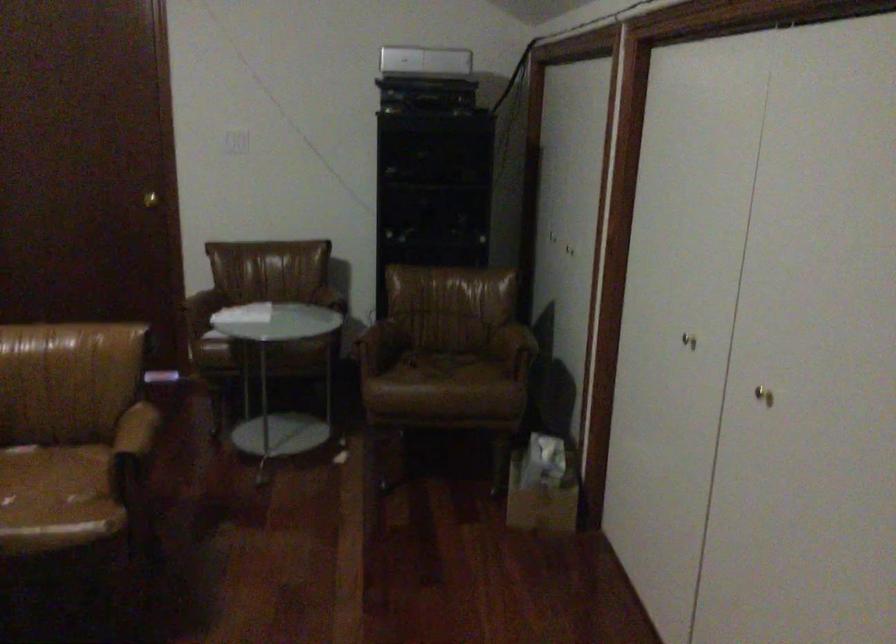
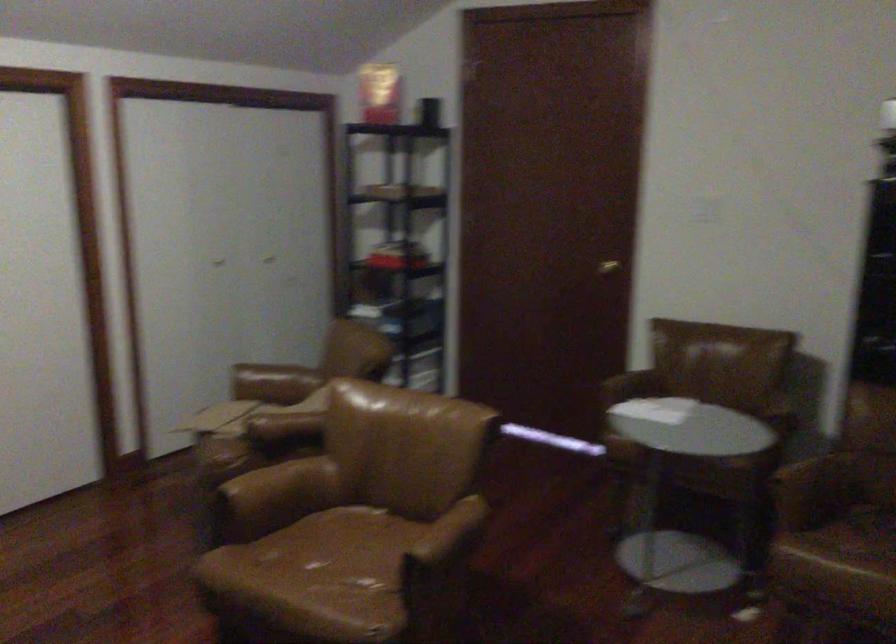
In the second image, find the point that corresponds to pixel 133 199 in the first image.

(607, 267)